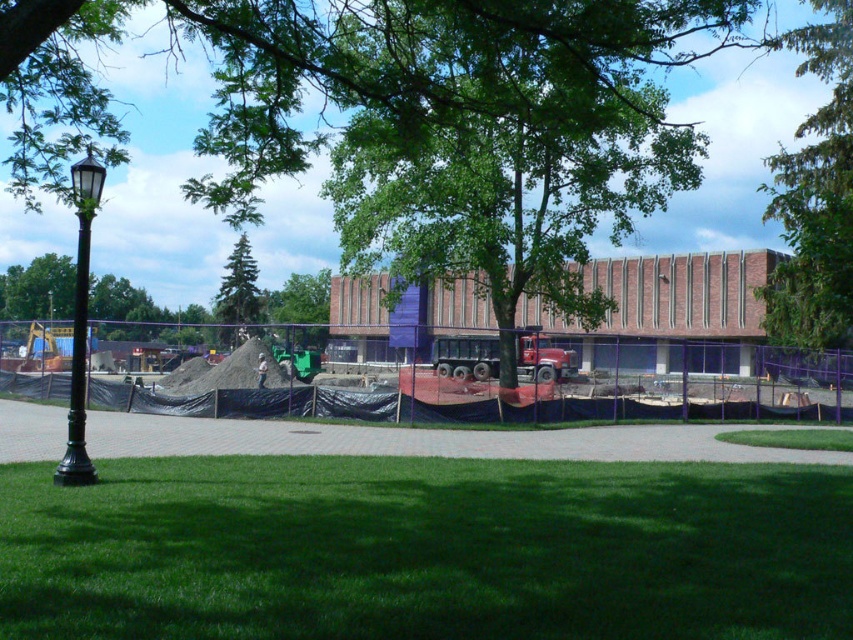
Question: Which point is closer to the camera?

Choices:
 (A) green leafy tree at upper center
 (B) green grass at lower center
 (C) green leafy tree at center
 (D) black polished metal lamp post at left

Answer: (B)

Question: Can you confirm if black polished metal lamp post at left is positioned to the left of green coniferous tree at upper left?

Choices:
 (A) yes
 (B) no

Answer: (B)

Question: Is green grass at lower center positioned behind black polished metal lamp post at left?

Choices:
 (A) yes
 (B) no

Answer: (B)

Question: Which of the following is the farthest from the observer?

Choices:
 (A) green coniferous tree at upper left
 (B) green leafy tree at center
 (C) green grass at lower center
 (D) black polished metal lamp post at left

Answer: (A)

Question: Which object appears farthest from the camera in this image?

Choices:
 (A) black polished metal lamp post at left
 (B) green leafy tree at upper center

Answer: (B)

Question: Considering the relative positions of green leafy tree at upper center and green leafy tree at center in the image provided, where is green leafy tree at upper center located with respect to green leafy tree at center?

Choices:
 (A) below
 (B) above

Answer: (B)